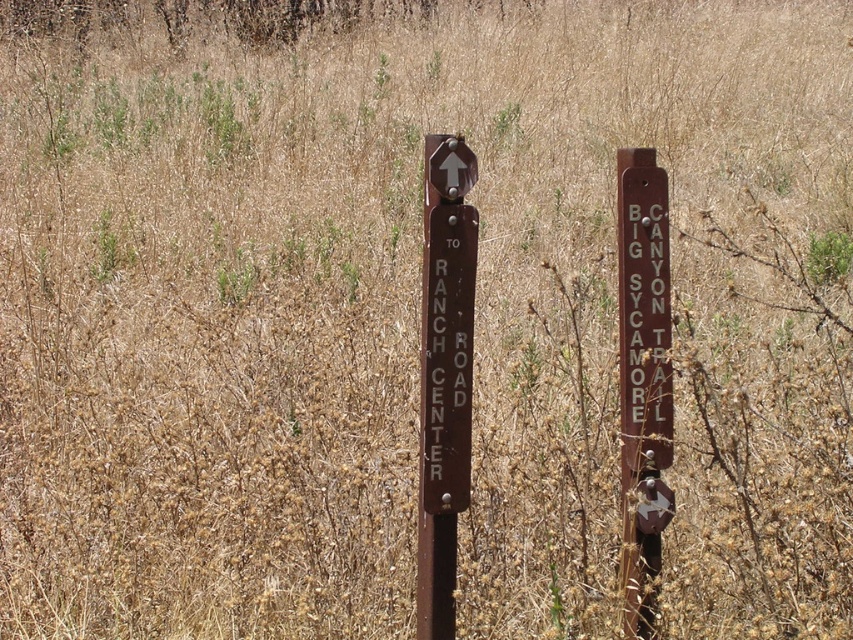
At what (x,y) coordinates should I click in order to perform the action: click on brown polished wood signpost at center. Please return your answer as a coordinate pair (x, y). The height and width of the screenshot is (640, 853). Looking at the image, I should click on (444, 374).

Which is in front, point (422, 298) or point (648, 308)?

Point (422, 298) is more forward.

The image size is (853, 640). Describe the element at coordinates (444, 374) in the screenshot. I see `brown polished wood signpost at center` at that location.

Where is `brown polished wood signpost at center`? This screenshot has width=853, height=640. brown polished wood signpost at center is located at coordinates (444, 374).